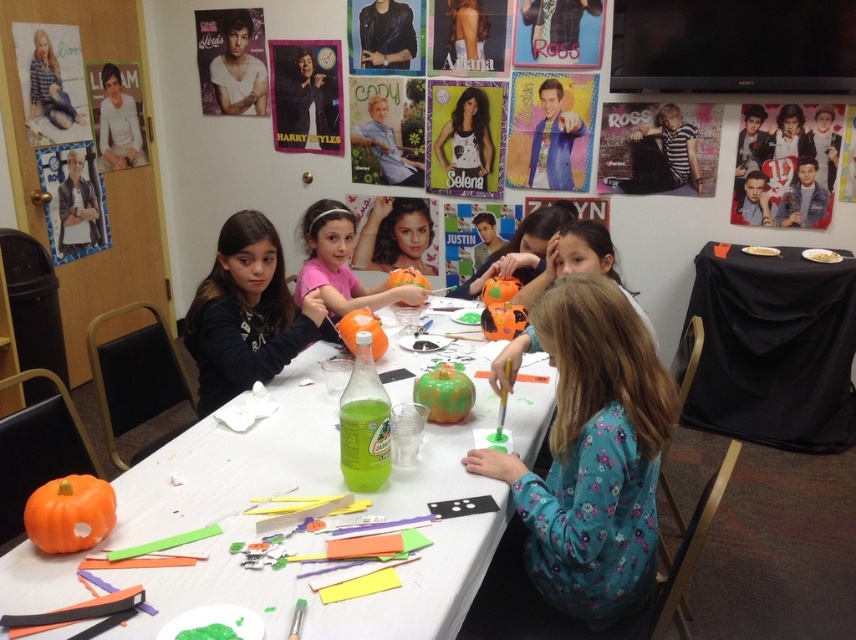
Which of these two, black cloth table at lower right or matte black shirt at center, stands taller?

black cloth table at lower right

Who is lower down, black cloth table at lower right or matte black shirt at center?

black cloth table at lower right is below.

Between point (837, 403) and point (276, 288), which one is positioned in front?

Point (276, 288) is more forward.

You are a GUI agent. You are given a task and a screenshot of the screen. Output one action in this format:
    pyautogui.click(x=<x>, y=<y>)
    Task: Click on the black cloth table at lower right
    The image size is (856, 640).
    Given the screenshot: What is the action you would take?
    pyautogui.click(x=771, y=348)

From the picture: Who is lower down, black cloth table at lower right or pink fabric shirt at center?

Positioned lower is black cloth table at lower right.

This screenshot has width=856, height=640. What are the coordinates of `black cloth table at lower right` in the screenshot? It's located at (771, 348).

Who is positioned more to the left, black cloth table at lower right or matte black poster at upper center?

From the viewer's perspective, matte black poster at upper center appears more on the left side.

Is black cloth table at lower right bigger than matte black poster at upper center?

Yes, black cloth table at lower right is bigger than matte black poster at upper center.

Is point (792, 248) closer to viewer compared to point (282, 65)?

Yes, point (792, 248) is in front of point (282, 65).

Identify the location of black cloth table at lower right. This screenshot has height=640, width=856. (771, 348).